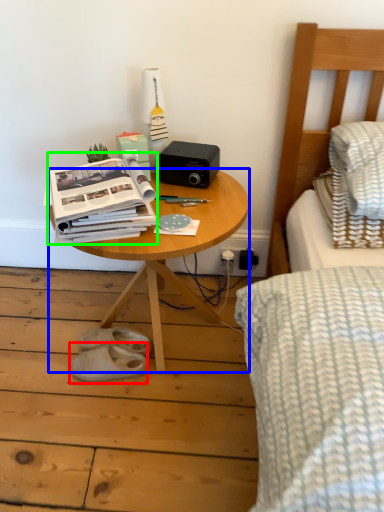
Question: Which object is positioned closest to footwear (highlighted by a red box)? Select from table (highlighted by a blue box) and paperback book (highlighted by a green box).

Choices:
 (A) table
 (B) paperback book

Answer: (A)